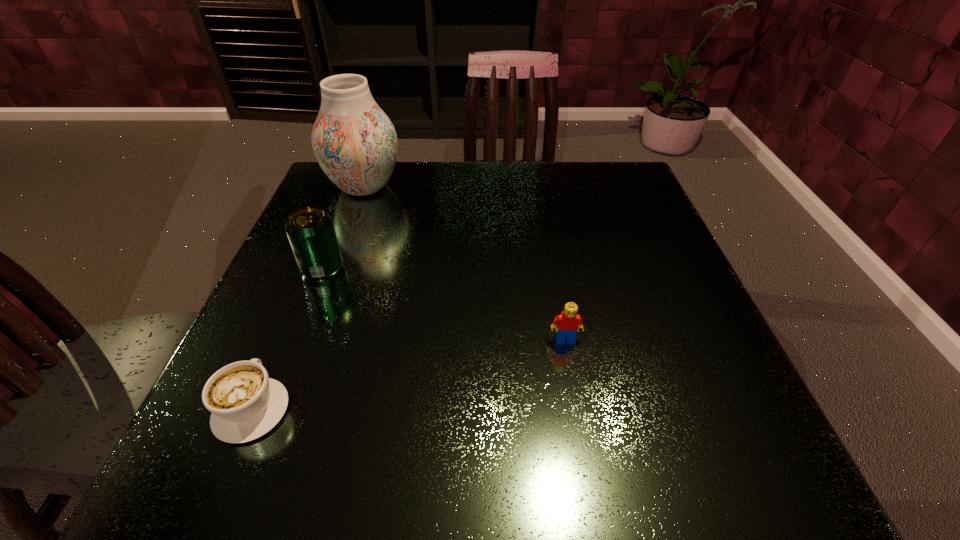
The height and width of the screenshot is (540, 960). Identify the location of free spot that satisfies the following two spatial constraints: 1. to the right of the beer can's handle; 2. on the left side of the nearest object. (311, 268).

Identify the location of free space that satisfies the following two spatial constraints: 1. to the right of the beer can's handle; 2. on the right side of the shortest object. (311, 268).